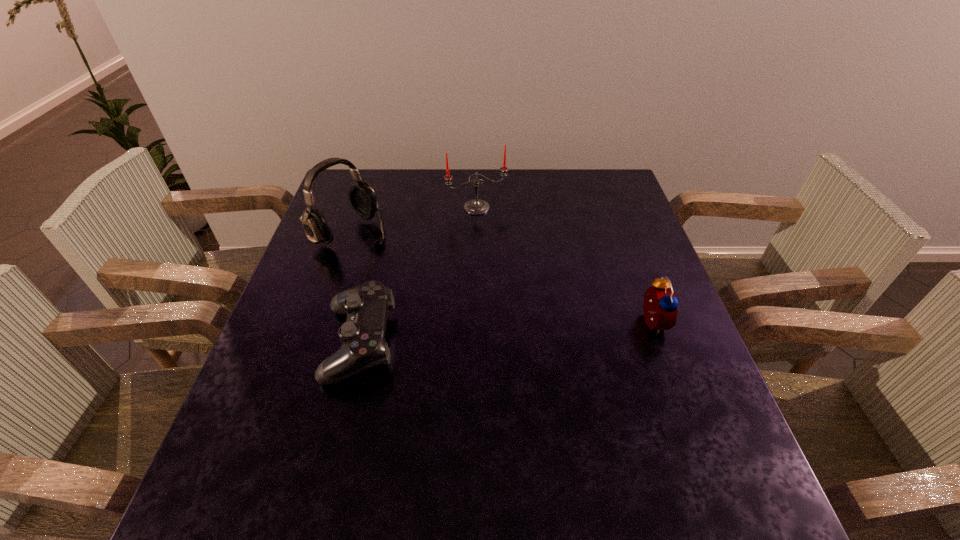
The height and width of the screenshot is (540, 960). In order to click on object that stands as the second closest to the candle in this screenshot , I will do `click(363, 345)`.

Identify the location of object that ranks as the third closest to the rightmost object. This screenshot has width=960, height=540. (362, 197).

Locate an element on the screen. The height and width of the screenshot is (540, 960). blank space that satisfies the following two spatial constraints: 1. on the back side of the shortest object; 2. on the front-facing side of the rightmost object is located at coordinates (365, 322).

At what (x,y) coordinates should I click in order to perform the action: click on blank space that satisfies the following two spatial constraints: 1. on the front side of the rightmost object; 2. on the front-facing side of the headset. Please return your answer as a coordinate pair (x, y). The height and width of the screenshot is (540, 960). Looking at the image, I should click on (322, 322).

Where is `vacant space that satisfies the following two spatial constraints: 1. on the back side of the headset; 2. on the right side of the candle`? Image resolution: width=960 pixels, height=540 pixels. vacant space that satisfies the following two spatial constraints: 1. on the back side of the headset; 2. on the right side of the candle is located at coordinates (360, 208).

Locate an element on the screen. Image resolution: width=960 pixels, height=540 pixels. free space that satisfies the following two spatial constraints: 1. on the front side of the rightmost object; 2. on the front-facing side of the third object from left to right is located at coordinates (476, 322).

Where is `vacant space that satisfies the following two spatial constraints: 1. on the front side of the third object from left to right; 2. on the front-facing side of the rightmost object`? This screenshot has height=540, width=960. vacant space that satisfies the following two spatial constraints: 1. on the front side of the third object from left to right; 2. on the front-facing side of the rightmost object is located at coordinates (476, 322).

The image size is (960, 540). Find the location of `vacant point that satisfies the following two spatial constraints: 1. on the back side of the control; 2. on the front-facing side of the alarm clock`. vacant point that satisfies the following two spatial constraints: 1. on the back side of the control; 2. on the front-facing side of the alarm clock is located at coordinates (365, 322).

Find the location of a particular element. free location that satisfies the following two spatial constraints: 1. on the front side of the rightmost object; 2. on the front-facing side of the second object from right to left is located at coordinates (476, 322).